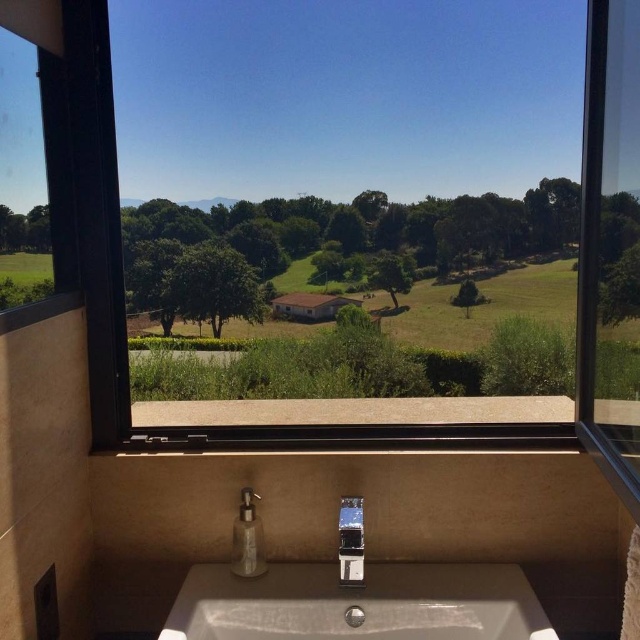
Is point (464, 600) more distant than point (348, 525)?

No, (464, 600) is in front of (348, 525).

The image size is (640, 640). In order to click on white ceramic sink at lower center in this screenshot , I will do `click(358, 604)`.

What are the coordinates of `white ceramic sink at lower center` in the screenshot? It's located at (358, 604).

Between transparent glass window at center and transparent glass window at upper left, which one is positioned lower?

transparent glass window at center is lower down.

From the picture: Measure the distance from transparent glass window at center to transparent glass window at upper left.

17.45 inches

Where is `transparent glass window at center`? The height and width of the screenshot is (640, 640). transparent glass window at center is located at coordinates (371, 216).

Is point (396, 637) in front of point (42, 52)?

That is False.

From the picture: Does white ceramic sink at lower center have a lesser height compared to transparent glass window at upper left?

Yes, white ceramic sink at lower center is shorter than transparent glass window at upper left.

The width and height of the screenshot is (640, 640). Identify the location of white ceramic sink at lower center. (358, 604).

Identify the location of white ceramic sink at lower center. (358, 604).